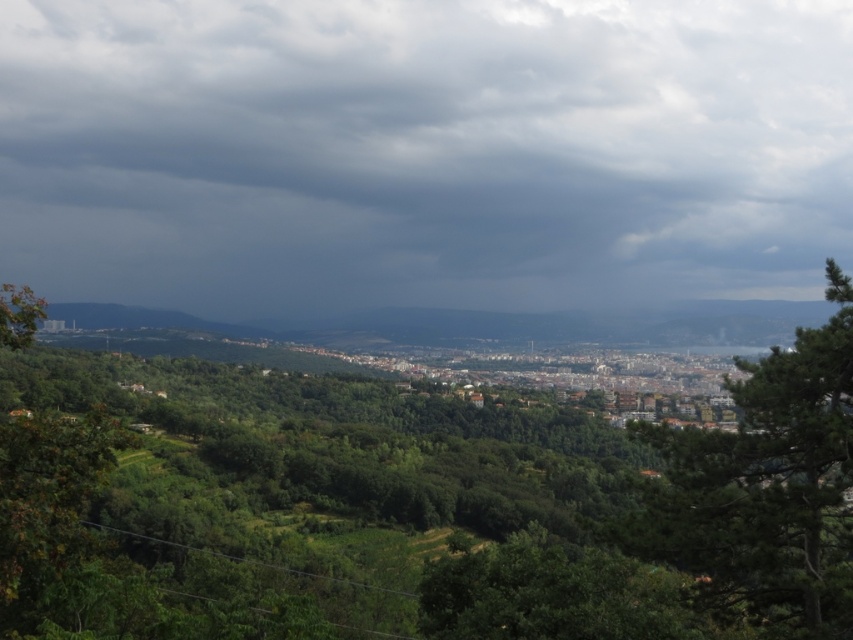
Question: Which point is closer to the camera?

Choices:
 (A) green leafy tree at center
 (B) green leafy tree at center-right

Answer: (B)

Question: Does dark gray cloud at upper center appear on the left side of green leafy tree at center-right?

Choices:
 (A) yes
 (B) no

Answer: (A)

Question: Which object is farther from the camera taking this photo?

Choices:
 (A) green leafy tree at center-right
 (B) dark gray cloud at upper center
 (C) green leafy tree at center

Answer: (B)

Question: Does green leafy tree at center appear under green leafy tree at center-right?

Choices:
 (A) yes
 (B) no

Answer: (A)

Question: Is green leafy tree at center further to camera compared to green leafy tree at center-right?

Choices:
 (A) no
 (B) yes

Answer: (B)

Question: Which point is closer to the camera?

Choices:
 (A) (616, 45)
 (B) (602, 618)
 (C) (689, 460)

Answer: (B)